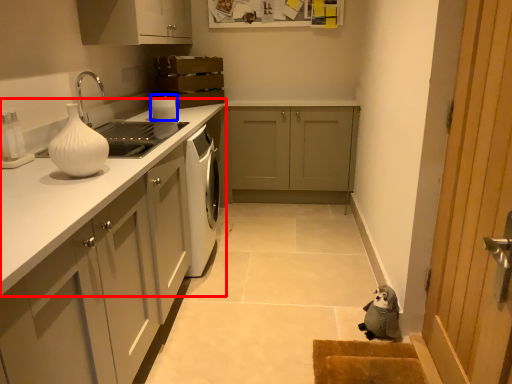
Question: Among these objects, which one is farthest to the camera, countertop (highlighted by a red box) or appliance (highlighted by a blue box)?

Choices:
 (A) countertop
 (B) appliance

Answer: (B)